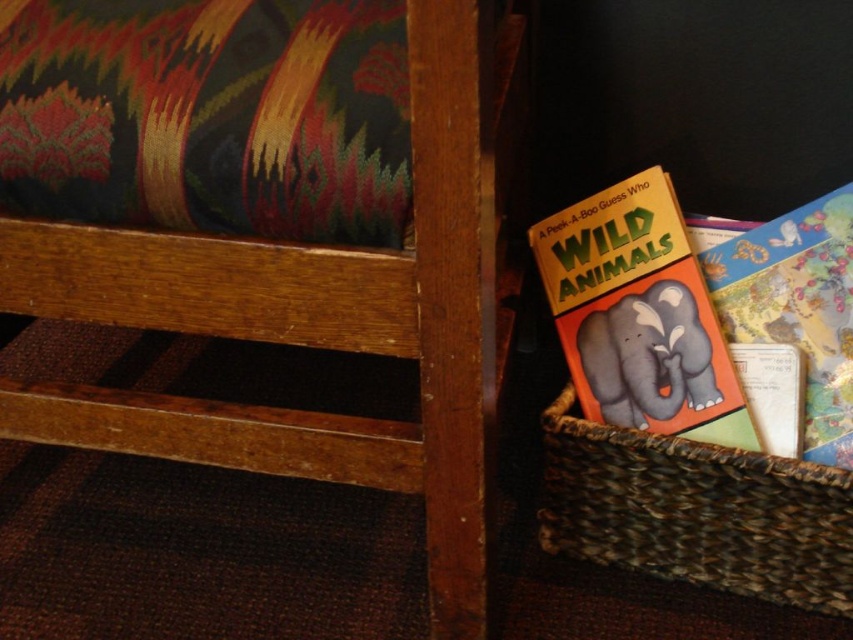
In the scene shown: Which is above, woven brown basket at lower right or matte orange book at lower right?

matte orange book at lower right is above.

Is woven brown basket at lower right bigger than matte orange book at lower right?

Yes.

Where is `woven brown basket at lower right`? This screenshot has width=853, height=640. woven brown basket at lower right is located at coordinates point(728,449).

Is velvet-like fabric pillow at upper left above woven brown basket at lower right?

Correct, velvet-like fabric pillow at upper left is located above woven brown basket at lower right.

Which is in front, point (146, 100) or point (595, 435)?

Point (146, 100) is more forward.

You are a GUI agent. You are given a task and a screenshot of the screen. Output one action in this format:
    pyautogui.click(x=<x>, y=<y>)
    Task: Click on the velvet-like fabric pillow at upper left
    The image size is (853, 640).
    Given the screenshot: What is the action you would take?
    pyautogui.click(x=207, y=115)

Can you confirm if matte yellow book at lower right is positioned to the right of matte orange book at lower right?

Incorrect, matte yellow book at lower right is not on the right side of matte orange book at lower right.

Does point (665, 308) come farther from viewer compared to point (773, 252)?

No, it is not.

What do you see at coordinates (639, 316) in the screenshot? The image size is (853, 640). I see `matte yellow book at lower right` at bounding box center [639, 316].

Where is `matte yellow book at lower right`? This screenshot has height=640, width=853. matte yellow book at lower right is located at coordinates (639, 316).